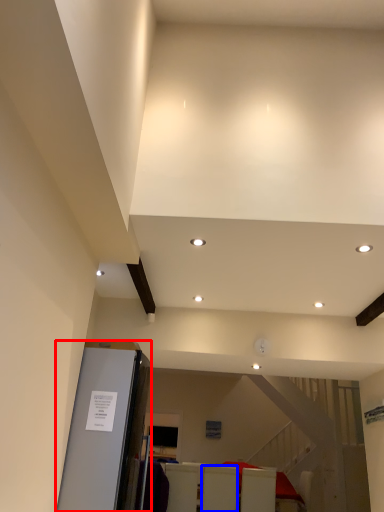
Question: Which of the following is the farthest to the observer, elevator (highlighted by a red box) or furniture (highlighted by a blue box)?

Choices:
 (A) elevator
 (B) furniture

Answer: (B)